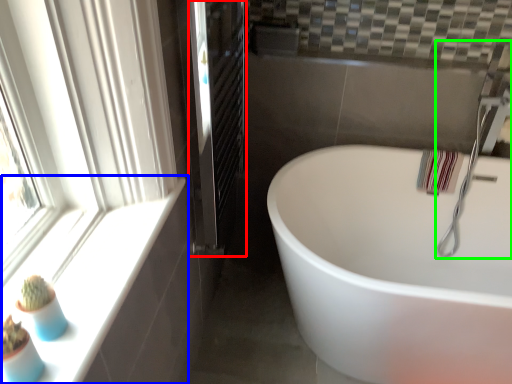
Question: Estimate the real-world distances between objects in this image. Which object is closer to screen door (highlighted by a red box), window sill (highlighted by a blue box) or faucet (highlighted by a green box)?

Choices:
 (A) window sill
 (B) faucet

Answer: (A)